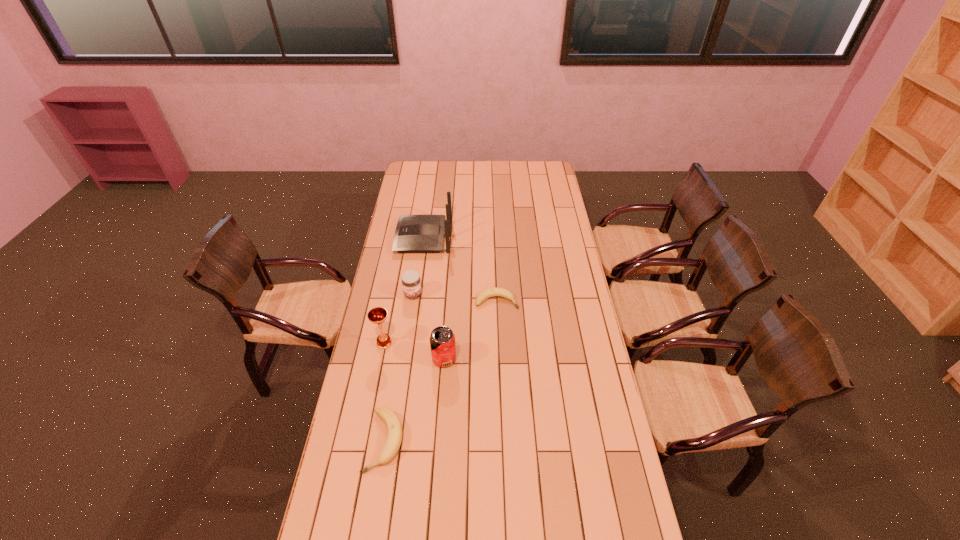
With all bananas evenly spaced, where should an extra banana be placed on the right to continue the pattern? Please point out a vacant space. Please provide its 2D coordinates. Your answer should be formatted as a tuple, i.e. [(x, y)], where the tuple contains the x and y coordinates of a point satisfying the conditions above.

[(566, 214)]